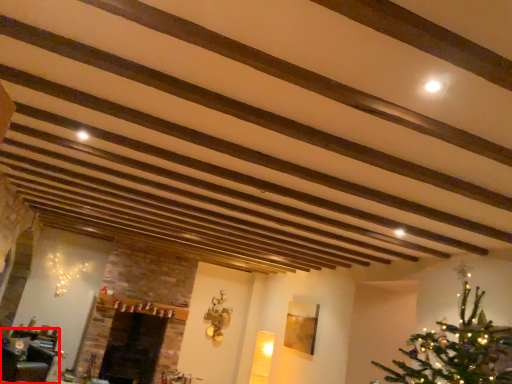
Question: Observing the image, what is the correct spatial positioning of furniture (annotated by the red box) in reference to fireplace?

Choices:
 (A) left
 (B) right

Answer: (A)